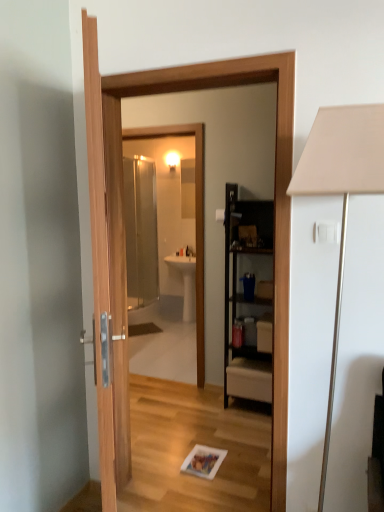
The width and height of the screenshot is (384, 512). In order to click on free space above transparent glass mirror at center (from a real-world perspective) in this screenshot , I will do `click(157, 130)`.